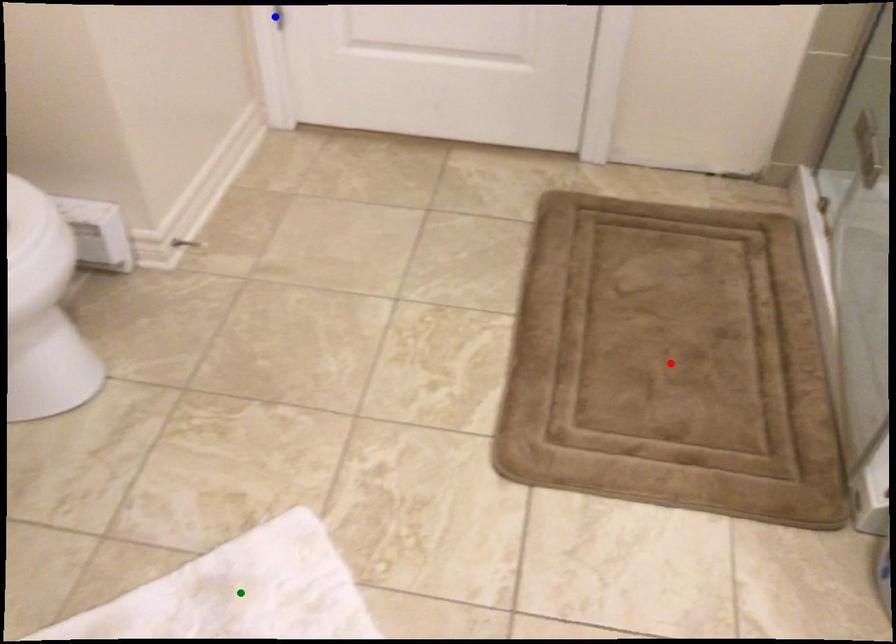
Order these from nearest to farthest:
1. red point
2. blue point
3. green point

green point, red point, blue point